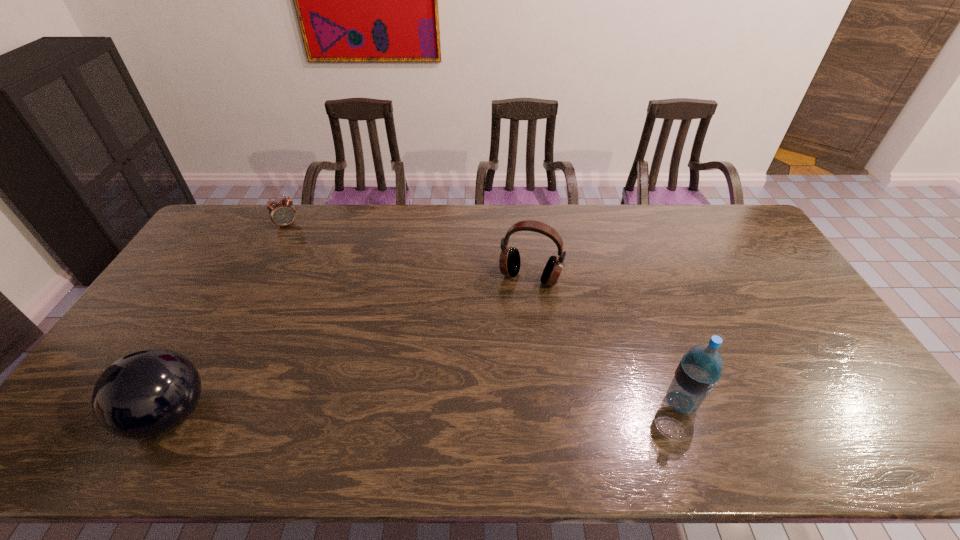
What are the coordinates of `vacant space situated 0.240m on the ear pads of the third object from left to right` in the screenshot? It's located at (500, 351).

Find the location of a particular element. The width and height of the screenshot is (960, 540). free location located 0.260m on the ear pads of the third object from left to right is located at coordinates (497, 356).

Locate an element on the screen. The width and height of the screenshot is (960, 540). vacant space located on the ear pads of the third object from left to right is located at coordinates click(x=496, y=360).

Locate an element on the screen. The image size is (960, 540). vacant space located on the face of the farthest object is located at coordinates (308, 281).

Where is `free space located 0.070m on the face of the farthest object`? free space located 0.070m on the face of the farthest object is located at coordinates (294, 241).

Find the location of a particular element. This screenshot has width=960, height=540. vacant space located on the face of the farthest object is located at coordinates (301, 262).

This screenshot has width=960, height=540. I want to click on object present at the far edge, so click(x=282, y=213).

Identify the location of bowling ball present at the near edge. This screenshot has width=960, height=540. (145, 394).

At what (x,y) coordinates should I click in order to perform the action: click on water bottle that is positioned at the near edge. Please return your answer as a coordinate pair (x, y). Image resolution: width=960 pixels, height=540 pixels. Looking at the image, I should click on (699, 370).

The height and width of the screenshot is (540, 960). In order to click on object located at the left edge in this screenshot , I will do `click(145, 394)`.